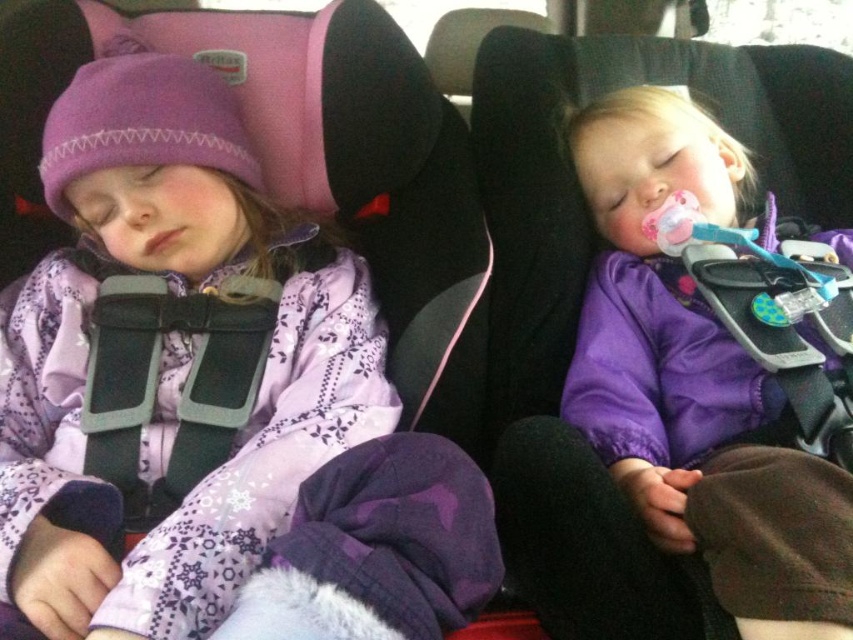
You are a parent checking the car seats for your children. You notice both the purple satin jacket at left and the purple satin baby at center are made of the same material. Which one has a bigger size?

The purple satin jacket at left has a larger size compared to the purple satin baby at center.

You are a parent in a car with two children. The purple satin jacket at left is on the left child, and the purple satin baby at center is the child in the middle. You need to hand a toy to the baby without waking the left child. Can you reach the baby from the driver seat without moving the left child?

The purple satin jacket at left and purple satin baby at center are 18.96 inches apart. Since the distance between them is 18.96 inches, you can likely reach the baby without moving the left child, as the space between them allows for arm extension without disturbing the left child.